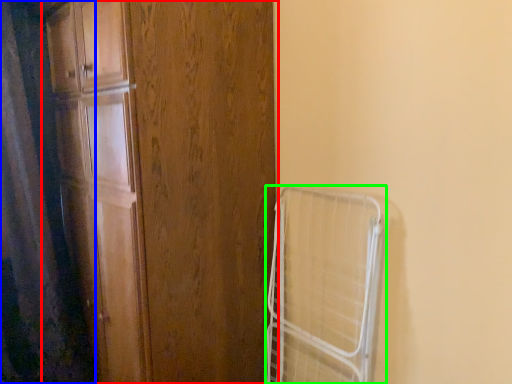
Question: Based on their relative distances, which object is nearer to door (highlighted by a red box)? Choose from shower curtain (highlighted by a blue box) and cage (highlighted by a green box).

Choices:
 (A) shower curtain
 (B) cage

Answer: (B)